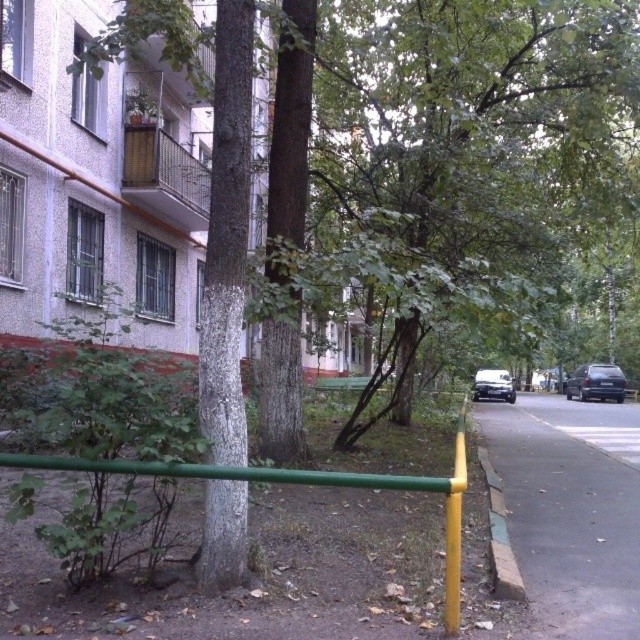
Question: Can you confirm if green bark tree at center is positioned to the left of asphalt pavement at lower right?

Choices:
 (A) no
 (B) yes

Answer: (B)

Question: Which object is farther from the camera taking this photo?

Choices:
 (A) asphalt pavement at lower right
 (B) green painted metal fence at lower center
 (C) shiny silver van at right

Answer: (C)

Question: Among these objects, which one is farthest from the camera?

Choices:
 (A) green bark tree at center
 (B) asphalt pavement at lower right

Answer: (A)

Question: Which of the following is the closest to the observer?

Choices:
 (A) (580, 272)
 (B) (609, 396)
 (C) (477, 390)

Answer: (C)

Question: Can you confirm if green leafy tree at center is positioned above green painted metal fence at lower center?

Choices:
 (A) yes
 (B) no

Answer: (A)

Question: Does green bark tree at center appear on the right side of shiny silver van at right?

Choices:
 (A) no
 (B) yes

Answer: (A)